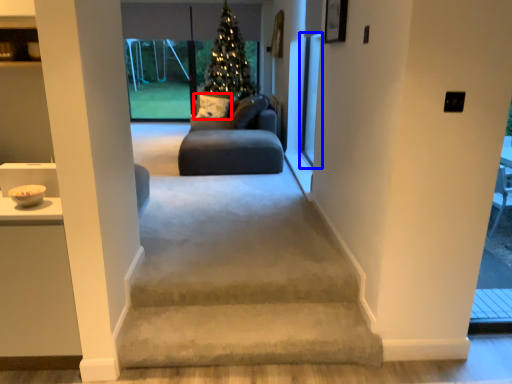
Question: Among these objects, which one is farthest to the camera, pillow (highlighted by a red box) or screen door (highlighted by a blue box)?

Choices:
 (A) pillow
 (B) screen door

Answer: (A)